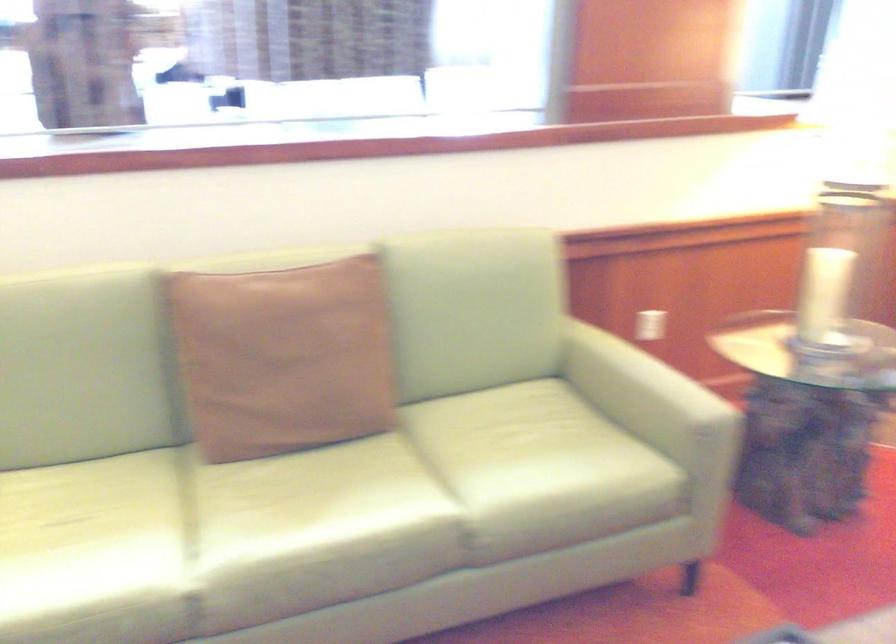
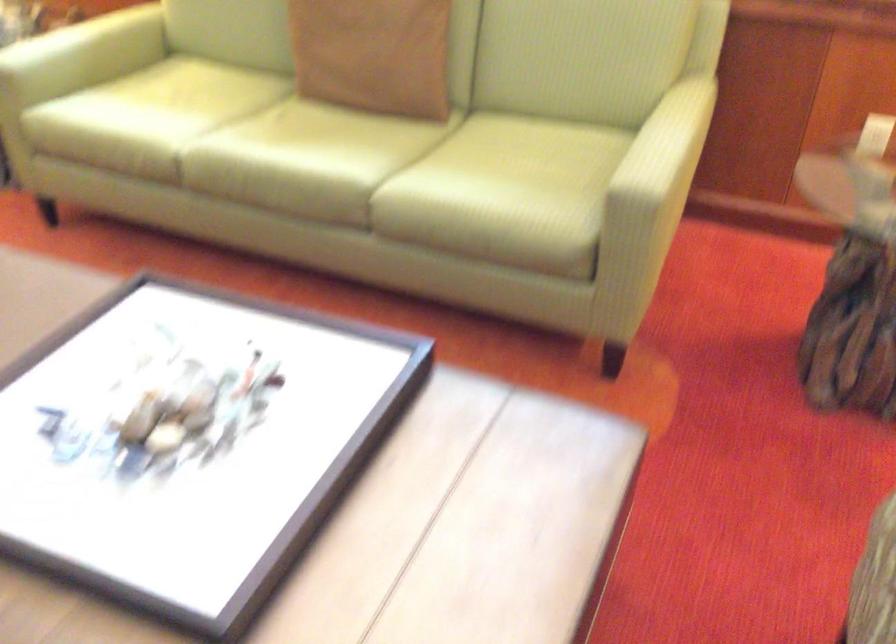
Find the pixel in the second image that matches (673,372) in the first image.

(668, 142)